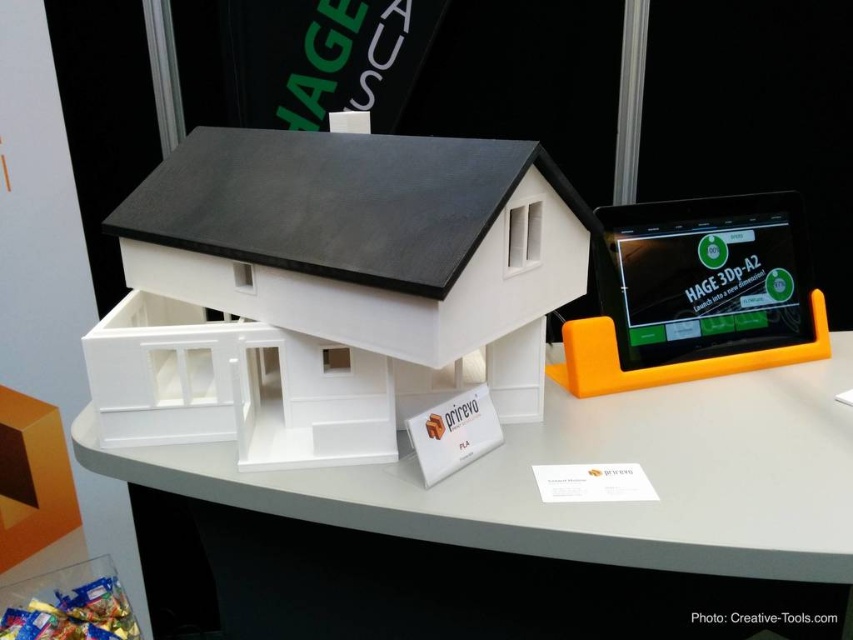
Question: Does white matte table at center have a lesser width compared to matte black tablet at right?

Choices:
 (A) no
 (B) yes

Answer: (A)

Question: Does white matte table at center have a larger size compared to matte black tablet at right?

Choices:
 (A) yes
 (B) no

Answer: (A)

Question: Is the position of white matte table at center less distant than that of matte black tablet at right?

Choices:
 (A) no
 (B) yes

Answer: (B)

Question: Which point is farther from the camera taking this photo?

Choices:
 (A) (491, 472)
 (B) (664, 276)

Answer: (B)

Question: Which point is farther from the camera taking this photo?

Choices:
 (A) (151, 449)
 (B) (723, 292)

Answer: (B)

Question: Which point is closer to the camera?

Choices:
 (A) (508, 451)
 (B) (755, 330)

Answer: (A)